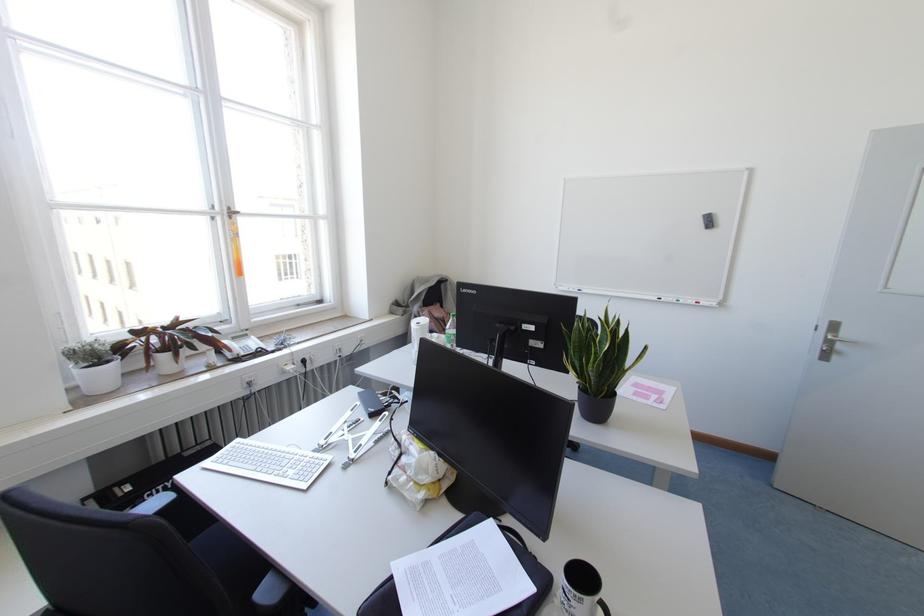
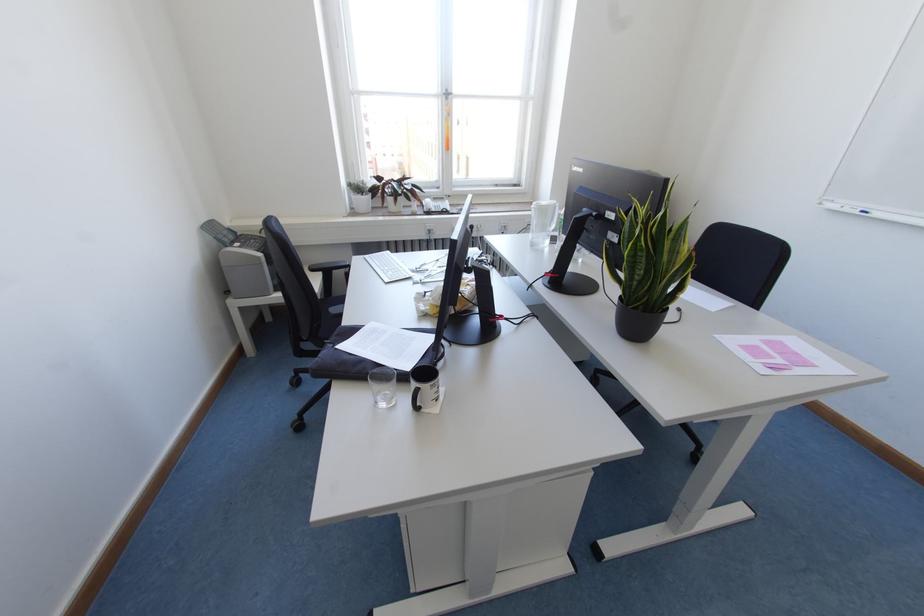
Locate, in the second image, the point that corresponds to (229,217) in the first image.

(446, 98)